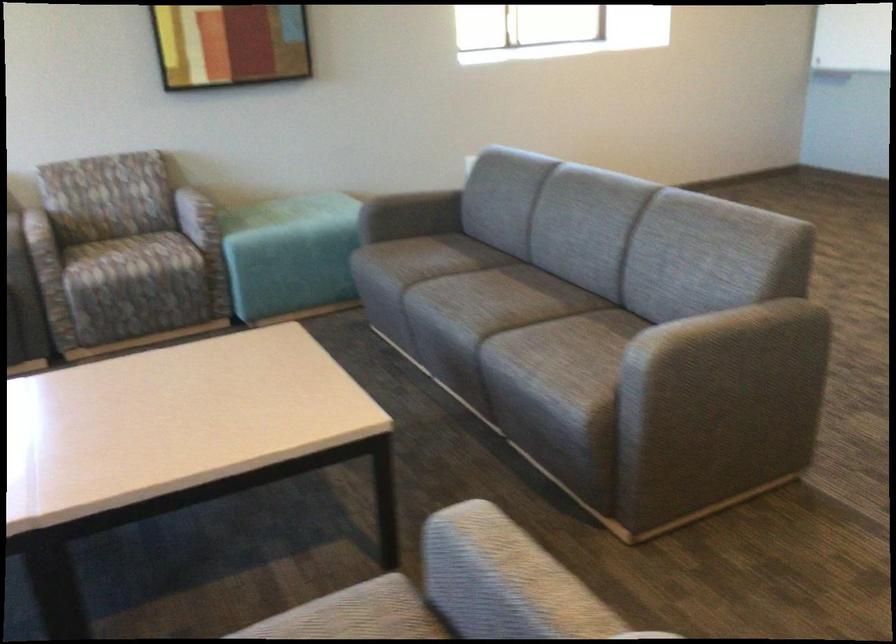
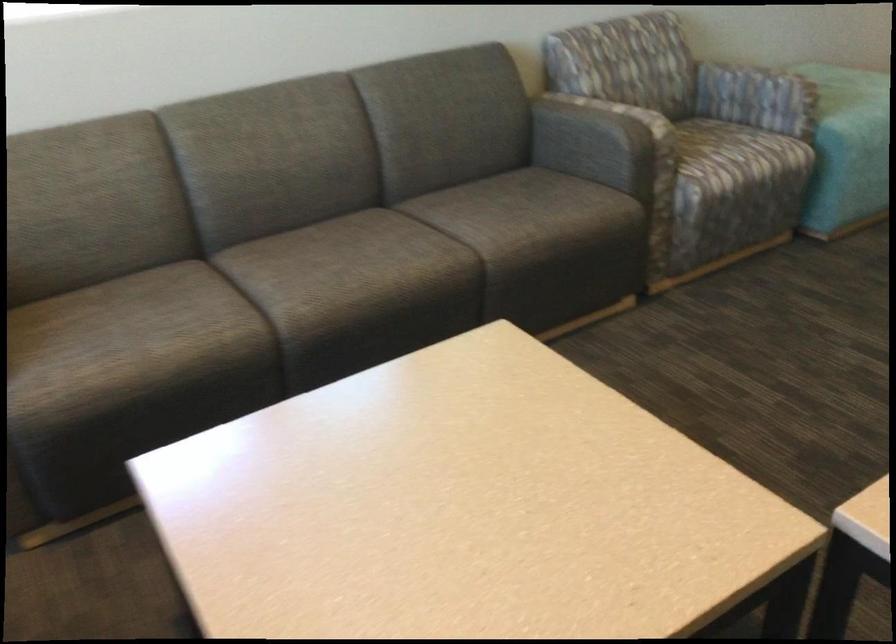
In the second image, find the point that corresponds to (x=263, y=249) in the first image.

(854, 129)